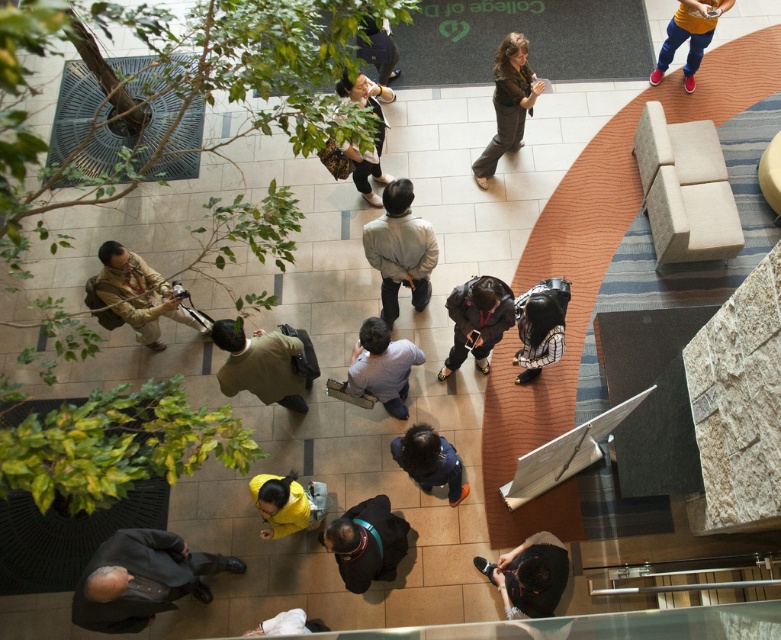
Can you confirm if camouflage jacket at lower left is positioned below white fabric at lower center?

No.

Who is more distant from viewer, (136, 337) or (298, 632)?

The point (136, 337) is more distant.

What do you see at coordinates (137, 296) in the screenshot?
I see `camouflage jacket at lower left` at bounding box center [137, 296].

Find the location of a particular element. The image size is (781, 640). camouflage jacket at lower left is located at coordinates (137, 296).

Is camouflage jacket at lower left closer to the viewer compared to dark gray fabric jacket at center?

That is False.

Based on the photo, who is higher up, camouflage jacket at lower left or dark gray fabric jacket at center?

camouflage jacket at lower left is higher up.

Who is more forward, (137, 276) or (455, 340)?

Point (137, 276) is in front.

You are a GUI agent. You are given a task and a screenshot of the screen. Output one action in this format:
    pyautogui.click(x=<x>, y=<y>)
    Task: Click on the camouflage jacket at lower left
    
    Given the screenshot: What is the action you would take?
    [x=137, y=296]

Is dark brown leather jacket at center shorter than orange cotton shirt at upper right?

No, dark brown leather jacket at center is not shorter than orange cotton shirt at upper right.

Does dark brown leather jacket at center have a lesser width compared to orange cotton shirt at upper right?

No, dark brown leather jacket at center is not thinner than orange cotton shirt at upper right.

Where is `dark brown leather jacket at center`? dark brown leather jacket at center is located at coordinates (508, 102).